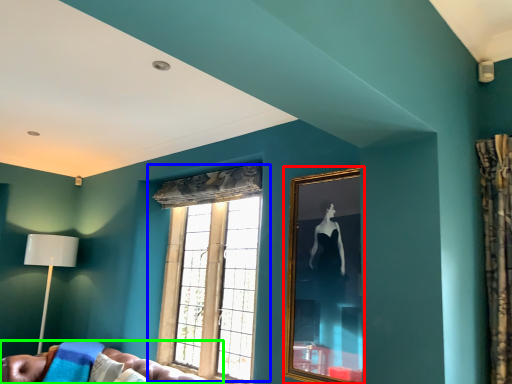
Question: Based on their relative distances, which object is farther from picture frame (highlighted by a red box)? Choose from window (highlighted by a blue box) and studio couch (highlighted by a green box).

Choices:
 (A) window
 (B) studio couch

Answer: (B)